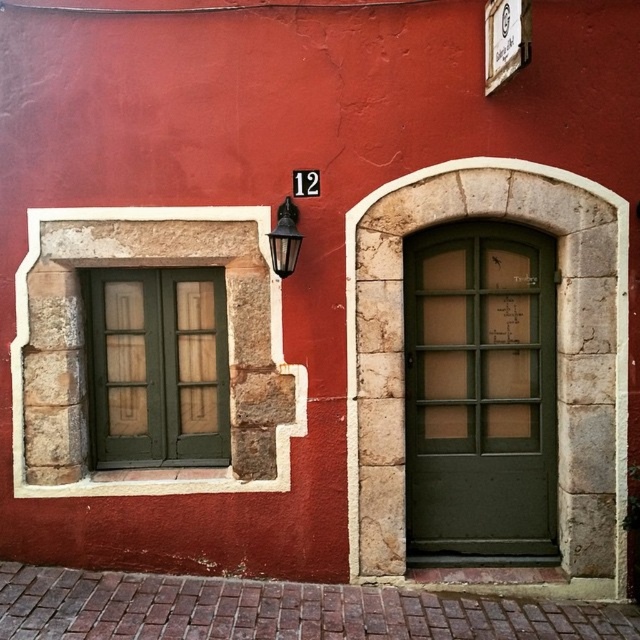
Looking at this image, you are standing in front of a building with a red facade. You see a green stone door at right and a green wood window at left. Which object is located to the right of the other?

The green stone door at right is positioned on the right side of the green wood window at left.

Looking at this image, you are a delivery person trying to find the correct entrance to a building. You see two doors, the green stone door at right and the green matte door at center. Which door is bigger and more likely to be the main entrance?

The green stone door at right has a larger size compared to the green matte door at center, making it more likely to be the main entrance.

You are an architect assessing the building facade. You need to install a new security camera that requires a mounting point higher than the center door. Which door should you choose between the green stone door at right and the green matte door at center?

The green stone door at right has a greater height compared to the green matte door at center, so you should choose the green stone door at right for mounting the security camera.